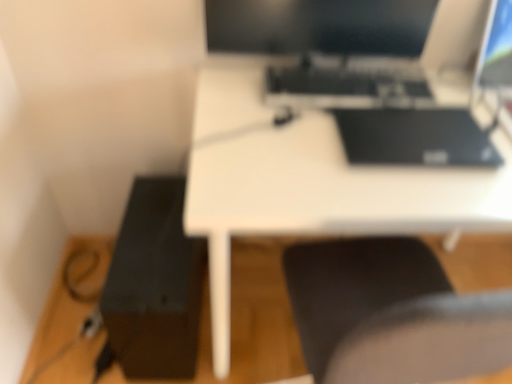
Locate an element on the screen. Image resolution: width=512 pixels, height=384 pixels. free space above black matte printer at lower left (from a real-world perspective) is located at coordinates (150, 235).